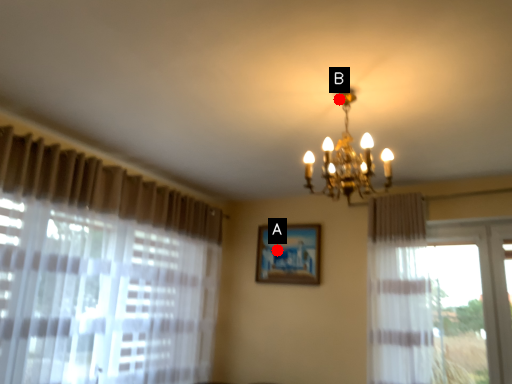
Question: Two points are circled on the image, labeled by A and B beside each circle. Which of the following is the closest to the observer?

Choices:
 (A) A is closer
 (B) B is closer

Answer: (B)